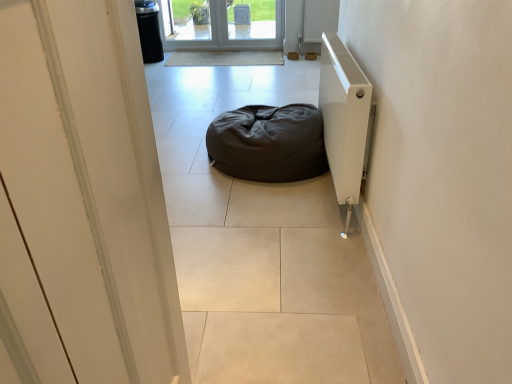
Where is `vacant space positioned to the left of white textured radiator at right`? This screenshot has width=512, height=384. vacant space positioned to the left of white textured radiator at right is located at coordinates (222, 191).